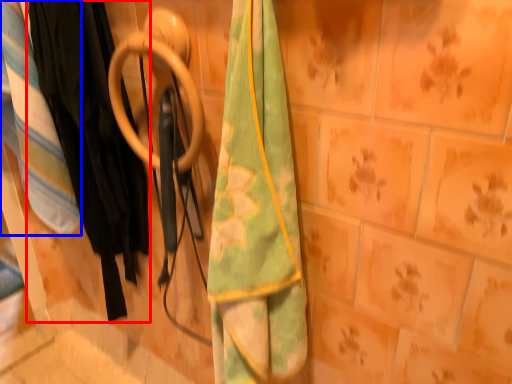
Question: Which of the following is the closest to the observer, clothing (highlighted by a red box) or blanket (highlighted by a blue box)?

Choices:
 (A) clothing
 (B) blanket

Answer: (A)